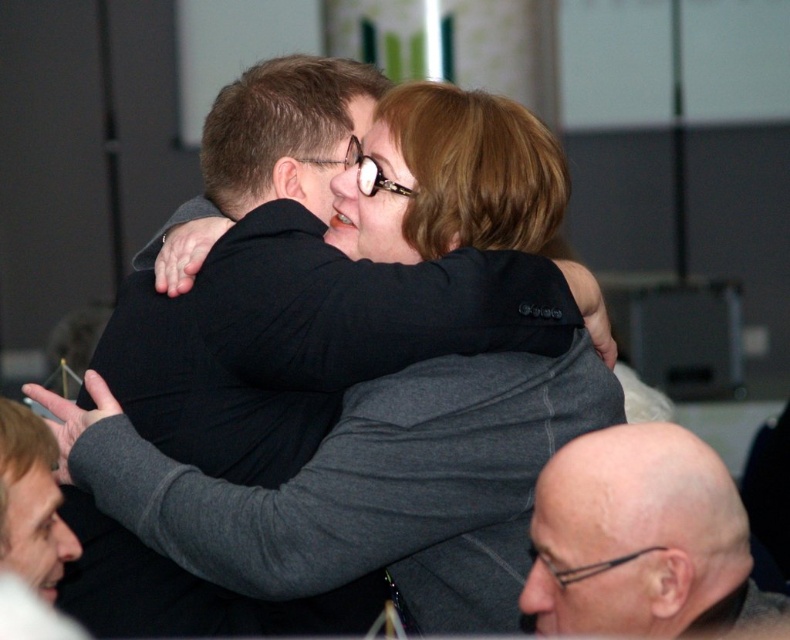
Looking at the two items at the center of the image, the dark gray sweater at center and the gray fabric jacket at center, which one is positioned to the right?

The dark gray sweater at center is positioned to the right of the gray fabric jacket at center.

You are standing in the conference room and need to determine the relative positions of two points marked in the image. Which point is closer to you, point (x=587, y=525) or point (x=21, y=465)?

Point (x=21, y=465) is closer to you because the description states that point (x=587, y=525) is further to the viewer than point (x=21, y=465).

You are standing in the conference room and want to place a new decoration exactly where the dark gray sweater at center is located. What coordinates should you use?

The coordinates for the dark gray sweater at center are at point (345, 368).